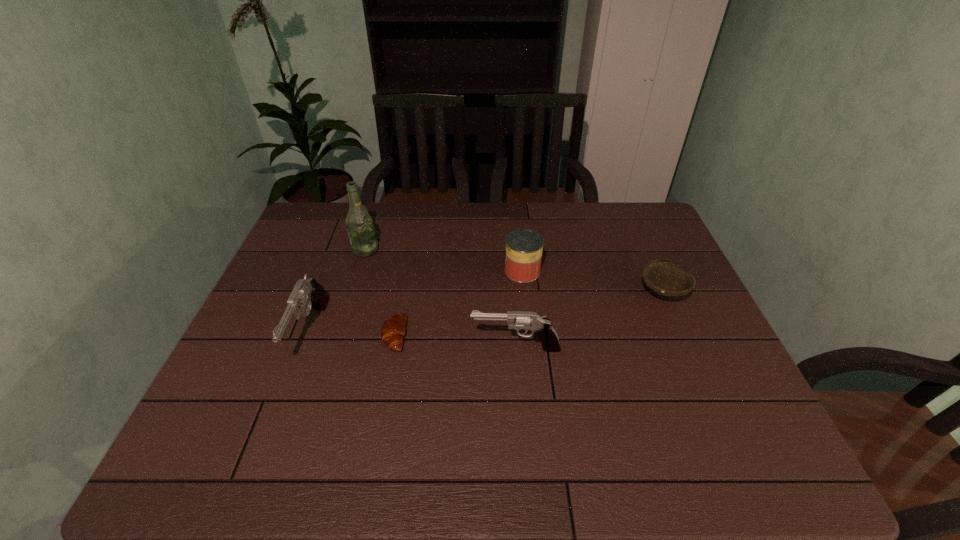
You are a GUI agent. You are given a task and a screenshot of the screen. Output one action in this format:
    pyautogui.click(x=<x>, y=<y>)
    Task: Click on the vacant area situated at the muzzle of the taller gun
    
    Given the screenshot: What is the action you would take?
    pyautogui.click(x=276, y=424)

Where is `free space located at the muzzle of the right gun`? This screenshot has width=960, height=540. free space located at the muzzle of the right gun is located at coordinates (372, 348).

I want to click on free spot located at the muzzle of the right gun, so (x=451, y=348).

Locate an element on the screen. This screenshot has width=960, height=540. vacant space located 0.090m at the muzzle of the right gun is located at coordinates (436, 348).

This screenshot has height=540, width=960. I want to click on free region located 0.130m on the surface of the farthest object, so click(x=420, y=250).

You are a GUI agent. You are given a task and a screenshot of the screen. Output one action in this format:
    pyautogui.click(x=<x>, y=<y>)
    Task: Click on the free space located 0.140m on the front of the bowl
    
    Given the screenshot: What is the action you would take?
    pyautogui.click(x=688, y=352)

Find the location of a particular element. The width and height of the screenshot is (960, 540). free spot located 0.150m on the back of the can is located at coordinates tap(518, 231).

Identify the location of vacant space located 0.340m on the back of the shortest object. (412, 241).

You are a GUI agent. You are given a task and a screenshot of the screen. Output one action in this format:
    pyautogui.click(x=<x>, y=<y>)
    Task: Click on the object that is at the far edge
    
    Given the screenshot: What is the action you would take?
    pyautogui.click(x=359, y=224)

I want to click on object at the left edge, so click(x=308, y=291).